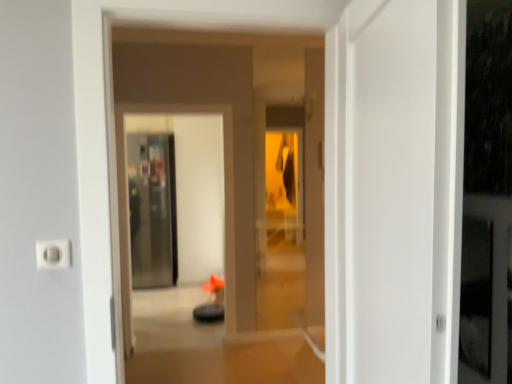
In order to face white plastic electric outlet at lower left, should I rotate leftwards or rightwards?

Rotate your view left by about 24.882°.

What is the approximate width of transparent glass screen door at center, which is the 2th screen door from right to left?

It is 11.63 inches.

What are the coordinates of `transparent glass screen door at center, which is the first screen door from front to back` in the screenshot? It's located at (127, 197).

How many degrees apart are the facing directions of orange fabric chair at center and transparent glass screen door at center, which is the first screen door from front to back?

orange fabric chair at center and transparent glass screen door at center, which is the first screen door from front to back, are facing 1.04 degrees away from each other.

Between orange fabric chair at center and transparent glass screen door at center, marked as the second screen door in a back-to-front arrangement, which one has smaller size?

orange fabric chair at center.

From the image's perspective, which one is positioned lower, orange fabric chair at center or transparent glass screen door at center, marked as the second screen door in a back-to-front arrangement?

transparent glass screen door at center, marked as the second screen door in a back-to-front arrangement.

From the picture: Who is bigger, transparent glass screen door at center, which is the 2th screen door from right to left, or white plastic electric outlet at lower left?

With larger size is transparent glass screen door at center, which is the 2th screen door from right to left.

Considering the sizes of objects transparent glass screen door at center, the first screen door when ordered from back to front, and white plastic electric outlet at lower left in the image provided, who is thinner, transparent glass screen door at center, the first screen door when ordered from back to front, or white plastic electric outlet at lower left?

Thinner between the two is white plastic electric outlet at lower left.

Is transparent glass screen door at center, which is the 2th screen door from right to left, aimed at white plastic electric outlet at lower left?

Yes, transparent glass screen door at center, which is the 2th screen door from right to left, is aimed at white plastic electric outlet at lower left.

From the picture: Can you confirm if transparent glass screen door at center, the first screen door when ordered from left to right, is taller than transparent glass screen door at center, which is the first screen door from front to back?

In fact, transparent glass screen door at center, the first screen door when ordered from left to right, may be shorter than transparent glass screen door at center, which is the first screen door from front to back.

From the image's perspective, which is above, transparent glass screen door at center, which is the 2th screen door from right to left, or transparent glass screen door at center, which appears as the second screen door when viewed from the left?

transparent glass screen door at center, which is the 2th screen door from right to left, appears higher in the image.

Is point (172, 231) closer to viewer compared to point (228, 272)?

No, (172, 231) is behind (228, 272).

Could you measure the distance between transparent glass screen door at center, the first screen door when ordered from back to front, and transparent glass screen door at center, which is the first screen door from front to back?

transparent glass screen door at center, the first screen door when ordered from back to front, and transparent glass screen door at center, which is the first screen door from front to back, are 8.95 feet apart from each other.

Between point (42, 250) and point (166, 259), which one is positioned in front?

The point (42, 250) is closer.

Between white plastic electric outlet at lower left and transparent glass screen door at center, which ranks as the second screen door in front-to-back order, which one has smaller size?

white plastic electric outlet at lower left.

Is white plastic electric outlet at lower left turned away from transparent glass screen door at center, which ranks as the second screen door in front-to-back order?

Yes, transparent glass screen door at center, which ranks as the second screen door in front-to-back order, is at the back of white plastic electric outlet at lower left.

Considering the relative positions of white plastic electric outlet at lower left and transparent glass screen door at center, the first screen door when ordered from left to right, in the image provided, is white plastic electric outlet at lower left to the left or to the right of transparent glass screen door at center, the first screen door when ordered from left to right,?

Clearly, white plastic electric outlet at lower left is on the right of transparent glass screen door at center, the first screen door when ordered from left to right, in the image.

Between transparent glass screen door at center, which is the first screen door from front to back, and orange fabric chair at center, which one has less height?

orange fabric chair at center.

How different are the orientations of transparent glass screen door at center, the 1th screen door when ordered from right to left, and orange fabric chair at center in degrees?

They differ by 1.04 degrees in their facing directions.

Measure the distance between transparent glass screen door at center, the 1th screen door when ordered from right to left, and orange fabric chair at center.

1.50 meters.

Which object is positioned more to the left, transparent glass screen door at center, which is the first screen door from front to back, or orange fabric chair at center?

From the viewer's perspective, transparent glass screen door at center, which is the first screen door from front to back, appears more on the left side.

Choose the correct answer: Is white plastic electric outlet at lower left inside transparent glass screen door at center, the 1th screen door when ordered from right to left, or outside it?

white plastic electric outlet at lower left is located beyond the bounds of transparent glass screen door at center, the 1th screen door when ordered from right to left.

Is point (46, 242) in front of point (118, 330)?

Yes.

Considering the sizes of objects white plastic electric outlet at lower left and transparent glass screen door at center, which is the first screen door from front to back, in the image provided, who is bigger, white plastic electric outlet at lower left or transparent glass screen door at center, which is the first screen door from front to back,?

transparent glass screen door at center, which is the first screen door from front to back, is bigger.

From the white plastic electric outlet at lower left, count 1st screen doors backward and point to it. Please provide its 2D coordinates.

[(127, 197)]

Does transparent glass screen door at center, the first screen door when ordered from back to front, have a smaller size compared to orange fabric chair at center?

No, transparent glass screen door at center, the first screen door when ordered from back to front, is not smaller than orange fabric chair at center.

From a real-world perspective, is transparent glass screen door at center, the first screen door when ordered from back to front, above or below orange fabric chair at center?

In terms of real-world spatial position, transparent glass screen door at center, the first screen door when ordered from back to front, is below orange fabric chair at center.

Image resolution: width=512 pixels, height=384 pixels. In order to click on screen door that is the 1st object located below the orange fabric chair at center (from the image's perspective) in this screenshot , I will do `click(152, 209)`.

Is transparent glass screen door at center, which is the 2th screen door from right to left, positioned behind orange fabric chair at center?

Yes, it is behind orange fabric chair at center.

Image resolution: width=512 pixels, height=384 pixels. Find the location of `hotel lobby that is above the transparent glass screen door at center, marked as the second screen door in a back-to-front arrangement (from the image's perspective)`. hotel lobby that is above the transparent glass screen door at center, marked as the second screen door in a back-to-front arrangement (from the image's perspective) is located at coordinates (233, 190).

You are a GUI agent. You are given a task and a screenshot of the screen. Output one action in this format:
    pyautogui.click(x=<x>, y=<y>)
    Task: Click on the 2nd screen door located beneath the white plastic electric outlet at lower left (from a real-world perspective)
    The width and height of the screenshot is (512, 384).
    Given the screenshot: What is the action you would take?
    (152, 209)

Which object lies further to the anchor point white plastic electric outlet at lower left, transparent glass screen door at center, which ranks as the second screen door in front-to-back order, or orange fabric chair at center?

The object further to white plastic electric outlet at lower left is transparent glass screen door at center, which ranks as the second screen door in front-to-back order.

Which object lies further to the anchor point transparent glass screen door at center, marked as the second screen door in a back-to-front arrangement, orange fabric chair at center or white plastic electric outlet at lower left?

The object further to transparent glass screen door at center, marked as the second screen door in a back-to-front arrangement, is orange fabric chair at center.

Estimate the real-world distances between objects in this image. Which object is further from orange fabric chair at center, transparent glass screen door at center, the 1th screen door when ordered from right to left, or white plastic electric outlet at lower left?

white plastic electric outlet at lower left is further to orange fabric chair at center.

Considering their positions, is transparent glass screen door at center, the first screen door when ordered from back to front, positioned closer to orange fabric chair at center than transparent glass screen door at center, which appears as the second screen door when viewed from the left?

transparent glass screen door at center, which appears as the second screen door when viewed from the left, is closer to orange fabric chair at center.

Based on their spatial positions, is white plastic electric outlet at lower left or transparent glass screen door at center, which is the 2th screen door from right to left, further from orange fabric chair at center?

white plastic electric outlet at lower left is further to orange fabric chair at center.

From the image, which object appears to be farther from transparent glass screen door at center, which is the first screen door from front to back, orange fabric chair at center or transparent glass screen door at center, the first screen door when ordered from back to front?

The object further to transparent glass screen door at center, which is the first screen door from front to back, is transparent glass screen door at center, the first screen door when ordered from back to front.

Estimate the real-world distances between objects in this image. Which object is further from orange fabric chair at center, transparent glass screen door at center, which is the 2th screen door from right to left, or white plastic electric outlet at lower left?

Among the two, white plastic electric outlet at lower left is located further to orange fabric chair at center.

Looking at the image, which one is located closer to transparent glass screen door at center, which is the 2th screen door from right to left, transparent glass screen door at center, which is the first screen door from front to back, or white plastic electric outlet at lower left?

Among the two, transparent glass screen door at center, which is the first screen door from front to back, is located nearer to transparent glass screen door at center, which is the 2th screen door from right to left.

Identify the location of electric outlet located between orange fabric chair at center and transparent glass screen door at center, which is the 2th screen door from right to left, in the depth direction. The image size is (512, 384). (53, 254).

Identify the location of electric outlet between orange fabric chair at center and transparent glass screen door at center, the 1th screen door when ordered from right to left, in the front-back direction. The height and width of the screenshot is (384, 512). (53, 254).

The image size is (512, 384). What are the coordinates of `screen door positioned between orange fabric chair at center and transparent glass screen door at center, the first screen door when ordered from left to right, from near to far` in the screenshot? It's located at (127, 197).

Image resolution: width=512 pixels, height=384 pixels. I want to click on screen door between white plastic electric outlet at lower left and transparent glass screen door at center, which ranks as the second screen door in front-to-back order, along the z-axis, so click(x=127, y=197).